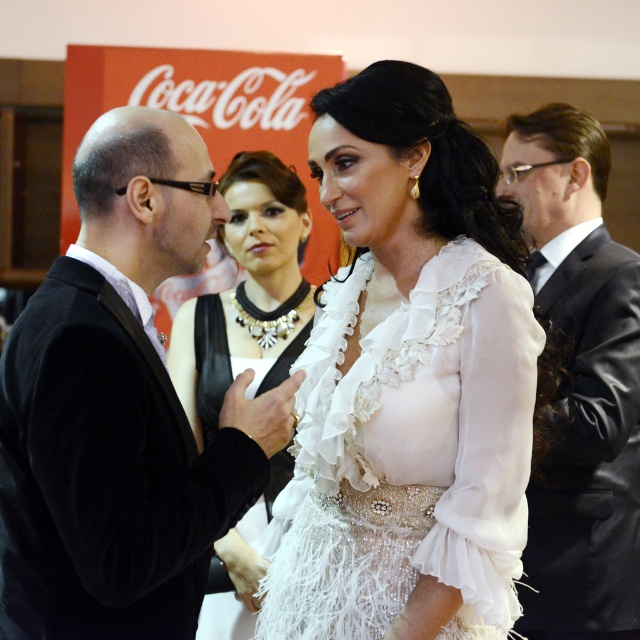
Does velvet black suit at left have a lesser height compared to white sheer dress at center?

In fact, velvet black suit at left may be taller than white sheer dress at center.

Does velvet black suit at left appear under white sheer dress at center?

Actually, velvet black suit at left is above white sheer dress at center.

Find the location of a particular element. This screenshot has height=640, width=640. velvet black suit at left is located at coordinates (120, 408).

Where is `velvet black suit at left`? velvet black suit at left is located at coordinates (120, 408).

Is velvet black suit at left below black satin suit at right?

Yes.

Does velvet black suit at left have a larger size compared to black satin suit at right?

No.

This screenshot has width=640, height=640. Describe the element at coordinates (120, 408) in the screenshot. I see `velvet black suit at left` at that location.

Find the location of a particular element. The height and width of the screenshot is (640, 640). velvet black suit at left is located at coordinates (120, 408).

Who is more distant from viewer, (120,589) or (182,364)?

The point (182,364) is behind.

Does velvet black suit at left appear over white lace dress at center?

Yes.

Image resolution: width=640 pixels, height=640 pixels. In order to click on velvet black suit at left in this screenshot , I will do `click(120, 408)`.